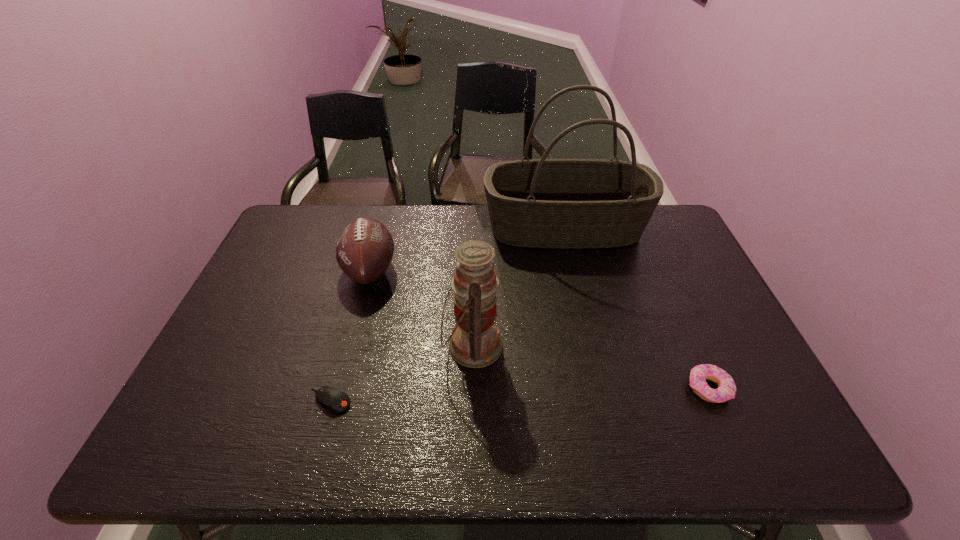
Image resolution: width=960 pixels, height=540 pixels. In order to click on free space between the basket and the shortest object in this screenshot , I will do `click(447, 314)`.

Point out which object is positioned as the fourth nearest to the oil lamp. Please provide its 2D coordinates. Your answer should be formatted as a tuple, i.e. [(x, y)], where the tuple contains the x and y coordinates of a point satisfying the conditions above.

[(726, 390)]

The width and height of the screenshot is (960, 540). Identify the location of object that can be found as the second closest to the football (American). click(543, 203).

Where is `vacant space that satisfies the following two spatial constraints: 1. on the front side of the fourth shortest object; 2. on the left side of the third shortest object`? This screenshot has height=540, width=960. vacant space that satisfies the following two spatial constraints: 1. on the front side of the fourth shortest object; 2. on the left side of the third shortest object is located at coordinates (349, 346).

Where is `vacant space that satisfies the following two spatial constraints: 1. on the back side of the third shortest object; 2. on the right side of the tallest object`? vacant space that satisfies the following two spatial constraints: 1. on the back side of the third shortest object; 2. on the right side of the tallest object is located at coordinates (382, 228).

What are the coordinates of `free space that satisfies the following two spatial constraints: 1. on the back side of the oil lamp; 2. on the left side of the tallest object` in the screenshot? It's located at (474, 228).